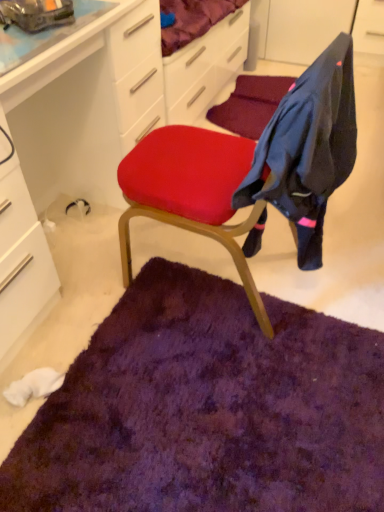
Question: Is point (23, 230) positioned closer to the camera than point (311, 153)?

Choices:
 (A) closer
 (B) farther

Answer: (B)

Question: In terms of width, does white glossy computer desk at upper left look wider or thinner when compared to dark blue fabric at upper right?

Choices:
 (A) thin
 (B) wide

Answer: (B)

Question: Based on their relative distances, which object is nearer to the purple shaggy rug at center?

Choices:
 (A) dark blue fabric at upper right
 (B) white glossy computer desk at upper left
 (C) matte red cushion at center

Answer: (C)

Question: Which is farther from the white glossy computer desk at upper left?

Choices:
 (A) matte red cushion at center
 (B) purple shaggy rug at center
 (C) dark blue fabric at upper right

Answer: (C)